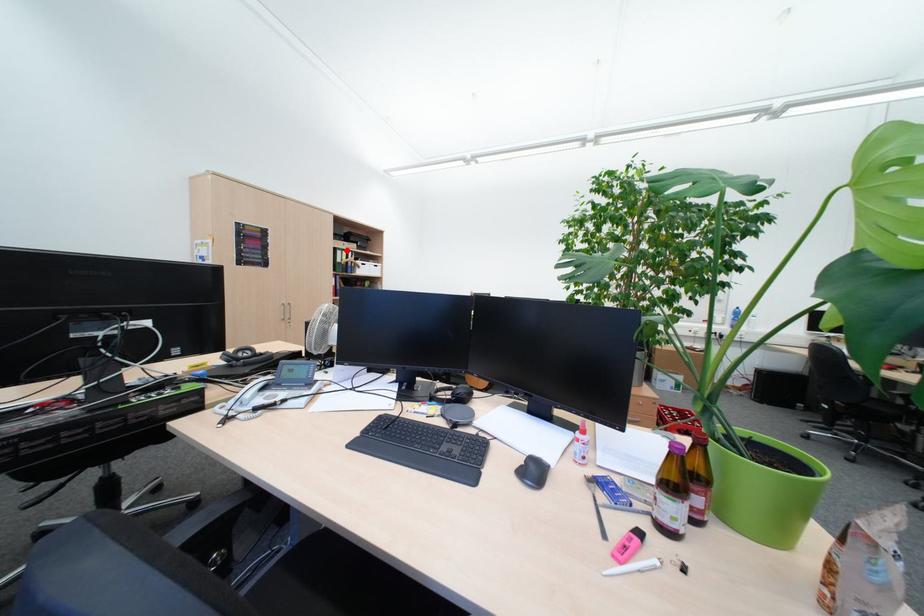
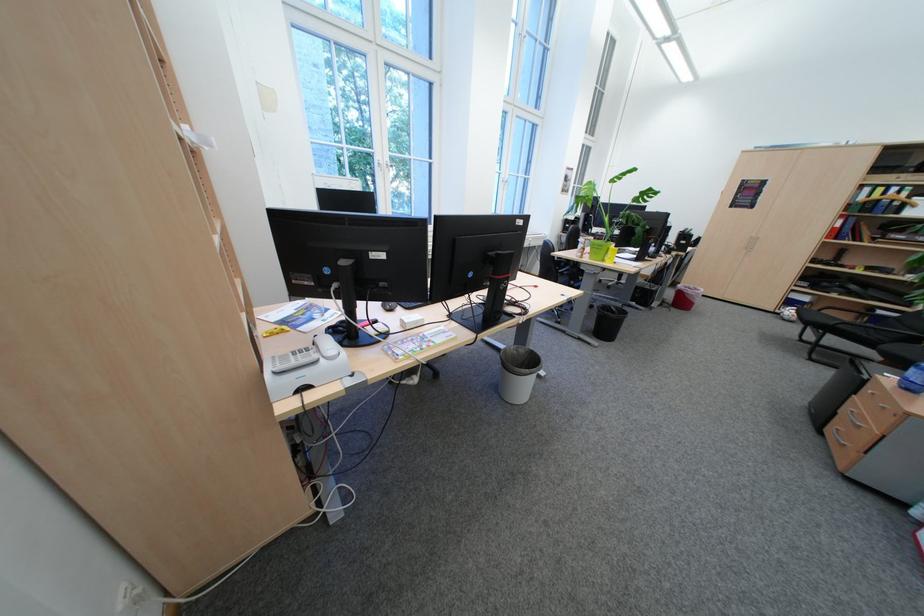
Question: I am providing you with two images of the same scene from different viewpoints. A red point is marked on the first image. Can you still see the location of the red point in image 2?

Choices:
 (A) Yes
 (B) No

Answer: (A)